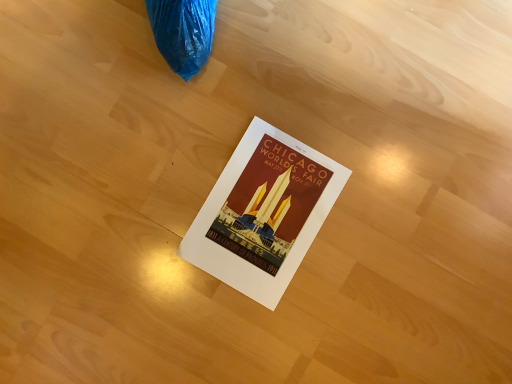
Where is `free space above matte paper poster at center (from a real-world perspective)`? free space above matte paper poster at center (from a real-world perspective) is located at coordinates (259, 212).